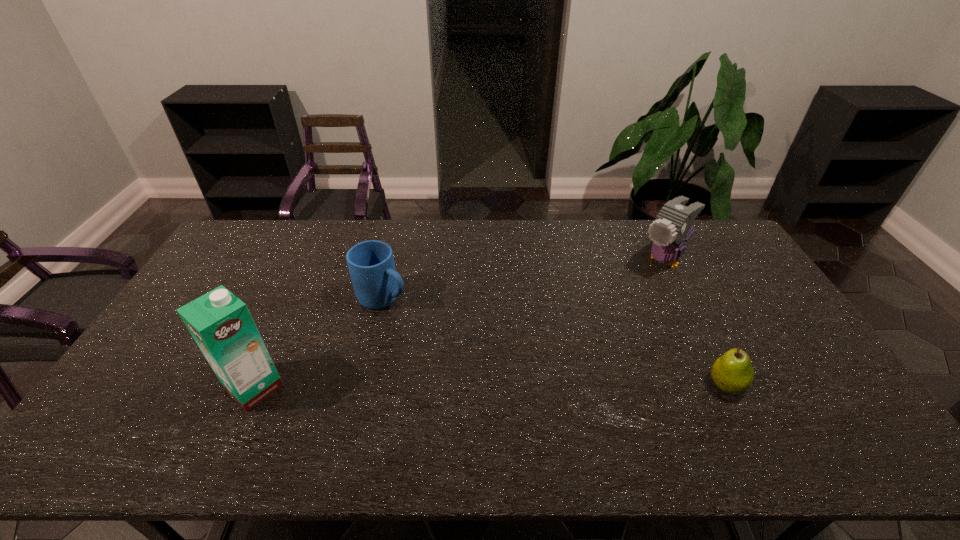
Where is `free point between the shortest object and the carton`? free point between the shortest object and the carton is located at coordinates (491, 386).

You are a GUI agent. You are given a task and a screenshot of the screen. Output one action in this format:
    pyautogui.click(x=<x>, y=<y>)
    Task: Click on the vacant area that lies between the farthest object and the leftmost object
    
    Given the screenshot: What is the action you would take?
    pyautogui.click(x=460, y=324)

Find the location of a particular element. free area in between the bird and the third tallest object is located at coordinates (524, 280).

Locate an element on the screen. This screenshot has height=540, width=960. free space that is in between the farthest object and the tallest object is located at coordinates (460, 324).

This screenshot has width=960, height=540. In order to click on vacant space in between the carton and the farthest object in this screenshot , I will do `click(460, 324)`.

In order to click on the third closest object relative to the shortest object in this screenshot , I will do `click(220, 323)`.

Point out which object is positioned as the nearest to the shortest object. Please provide its 2D coordinates. Your answer should be formatted as a tuple, i.e. [(x, y)], where the tuple contains the x and y coordinates of a point satisfying the conditions above.

[(673, 227)]

The height and width of the screenshot is (540, 960). I want to click on vacant space that satisfies the following two spatial constraints: 1. on the back side of the leftmost object; 2. on the right side of the second shortest object, so click(x=295, y=299).

The image size is (960, 540). In order to click on vacant position in the image that satisfies the following two spatial constraints: 1. on the back side of the farthest object; 2. on the right side of the carton in this screenshot , I will do `click(312, 261)`.

Identify the location of vacant space that satisfies the following two spatial constraints: 1. on the back side of the leftmost object; 2. on the right side of the mug. The width and height of the screenshot is (960, 540). 295,299.